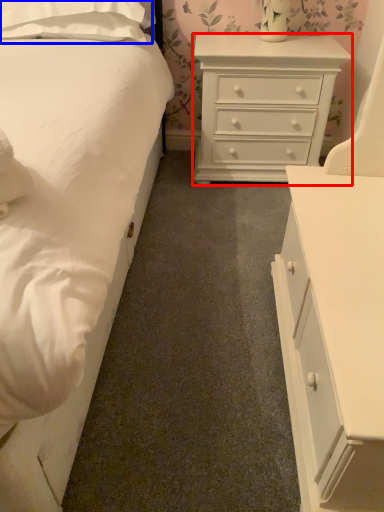
Question: Which object is further to the camera taking this photo, chest of drawers (highlighted by a red box) or pillow (highlighted by a blue box)?

Choices:
 (A) chest of drawers
 (B) pillow

Answer: (A)